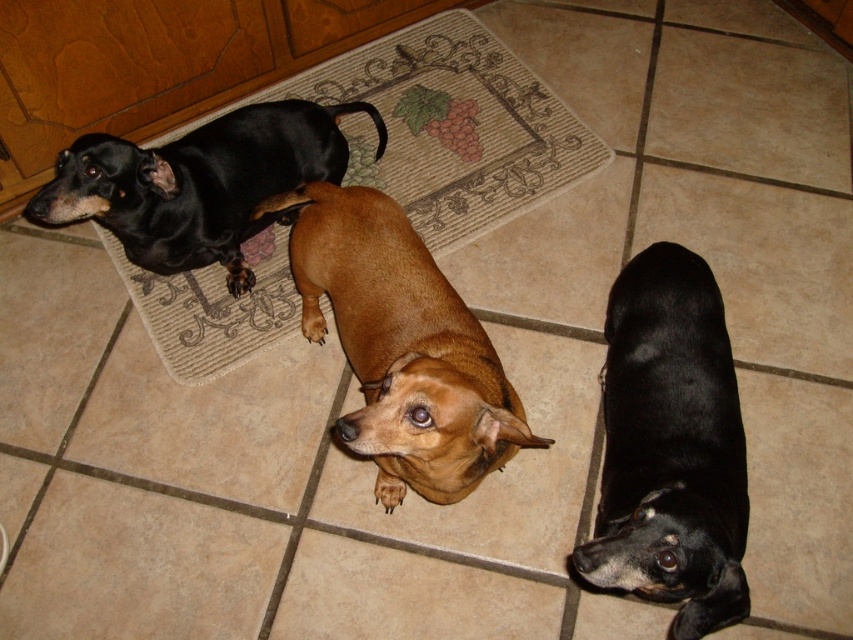
Measure the distance between brown smooth dog at center and shiny black dog at upper left.

brown smooth dog at center is 14.44 inches away from shiny black dog at upper left.

Is brown smooth dog at center positioned before shiny black dog at upper left?

That is True.

Identify the location of brown smooth dog at center. The height and width of the screenshot is (640, 853). (401, 346).

Identify the location of brown smooth dog at center. (401, 346).

Who is more forward, (x=740, y=534) or (x=236, y=243)?

Positioned in front is point (x=740, y=534).

The width and height of the screenshot is (853, 640). Find the location of `black matte dog at lower right`. black matte dog at lower right is located at coordinates (670, 445).

Is point (703, 420) positioned after point (422, 355)?

Yes.

Is point (698, 369) less distant than point (393, 426)?

No, it is not.

Which is behind, point (722, 365) or point (312, 332)?

Positioned behind is point (312, 332).

Locate an element on the screen. Image resolution: width=853 pixels, height=640 pixels. black matte dog at lower right is located at coordinates (670, 445).